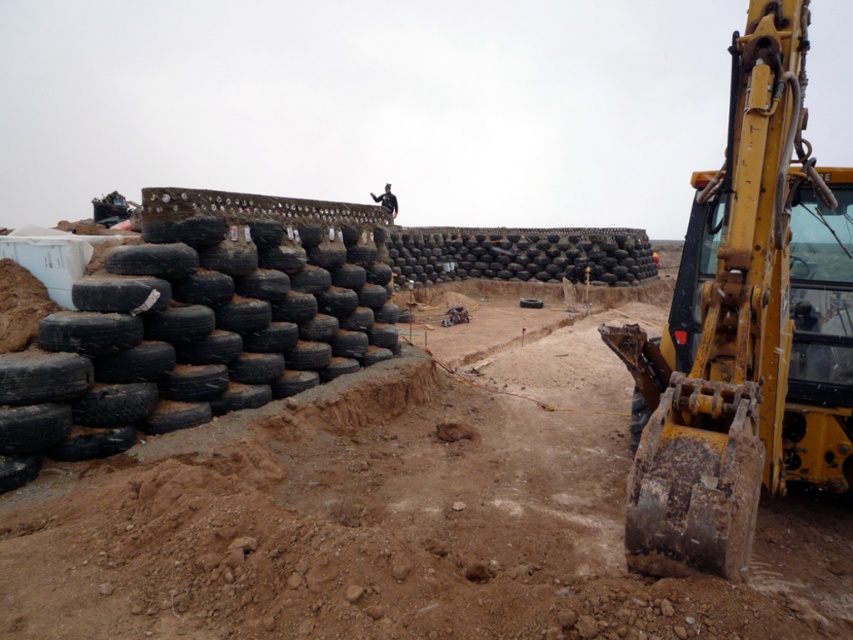
Does point (848, 224) lie in front of point (508, 253)?

That is True.

Consider the image. Who is positioned more to the right, yellow metallic excavator at right or black rubber tires at center?

Positioned to the right is black rubber tires at center.

Does point (849, 353) come farther from viewer compared to point (389, 248)?

No, (849, 353) is closer to viewer.

Identify the location of yellow metallic excavator at right. This screenshot has height=640, width=853. (746, 324).

Does black rubber tires at center have a greater width compared to black matte construction worker at upper center?

Yes, black rubber tires at center is wider than black matte construction worker at upper center.

In the scene shown: Who is higher up, black rubber tires at center or black matte construction worker at upper center?

black matte construction worker at upper center is above.

Who is more distant from viewer, (416,241) or (374,200)?

Positioned behind is point (374,200).

What are the coordinates of `black rubber tires at center` in the screenshot? It's located at (521, 252).

Which is more to the right, black matte construction worker at upper center or black rubber tire at center?

black rubber tire at center is more to the right.

Who is more forward, (395, 196) or (531, 305)?

Point (531, 305)

Does point (386, 196) come closer to viewer compared to point (538, 300)?

No, it is not.

I want to click on black matte construction worker at upper center, so pyautogui.click(x=386, y=200).